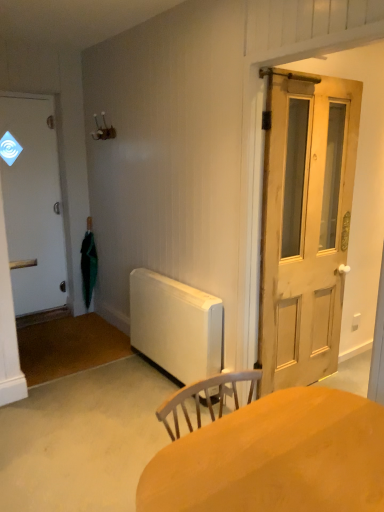
Question: Considering the relative sizes of natural wood door at right, which appears as the second door when viewed from the back, and smooth wooden desk at center in the image provided, is natural wood door at right, which appears as the second door when viewed from the back, smaller than smooth wooden desk at center?

Choices:
 (A) no
 (B) yes

Answer: (B)

Question: Is natural wood door at right, which is counted as the 2th door, starting from the left, thinner than smooth wooden desk at center?

Choices:
 (A) yes
 (B) no

Answer: (A)

Question: Considering the relative sizes of natural wood door at right, which appears as the second door when viewed from the back, and smooth wooden desk at center in the image provided, is natural wood door at right, which appears as the second door when viewed from the back, taller than smooth wooden desk at center?

Choices:
 (A) yes
 (B) no

Answer: (A)

Question: From a real-world perspective, is natural wood door at right, which is counted as the 2th door, starting from the left, located beneath smooth wooden desk at center?

Choices:
 (A) no
 (B) yes

Answer: (A)

Question: Is natural wood door at right, placed as the first door when sorted from front to back, outside smooth wooden desk at center?

Choices:
 (A) no
 (B) yes

Answer: (B)

Question: Is natural wood door at right, which is the 1th door in right-to-left order, aimed at smooth wooden desk at center?

Choices:
 (A) yes
 (B) no

Answer: (B)

Question: From the image's perspective, would you say white matte radiator at center is positioned over white matte door at left, the first door positioned from the left?

Choices:
 (A) yes
 (B) no

Answer: (B)

Question: Is the position of white matte radiator at center more distant than that of white matte door at left, the second door in the right-to-left sequence?

Choices:
 (A) yes
 (B) no

Answer: (B)

Question: Can you confirm if white matte radiator at center is taller than white matte door at left, the first door positioned from the left?

Choices:
 (A) yes
 (B) no

Answer: (B)

Question: Is white matte radiator at center in front of white matte door at left, the 1th door when ordered from back to front?

Choices:
 (A) yes
 (B) no

Answer: (A)

Question: Can you confirm if white matte radiator at center is shorter than white matte door at left, the first door positioned from the left?

Choices:
 (A) no
 (B) yes

Answer: (B)

Question: Is white matte radiator at center completely or partially outside of white matte door at left, the first door positioned from the left?

Choices:
 (A) no
 (B) yes

Answer: (B)

Question: Would you say white matte door at left, the 1th door when ordered from back to front, is a long distance from natural wood door at right, placed as the first door when sorted from front to back?

Choices:
 (A) yes
 (B) no

Answer: (A)